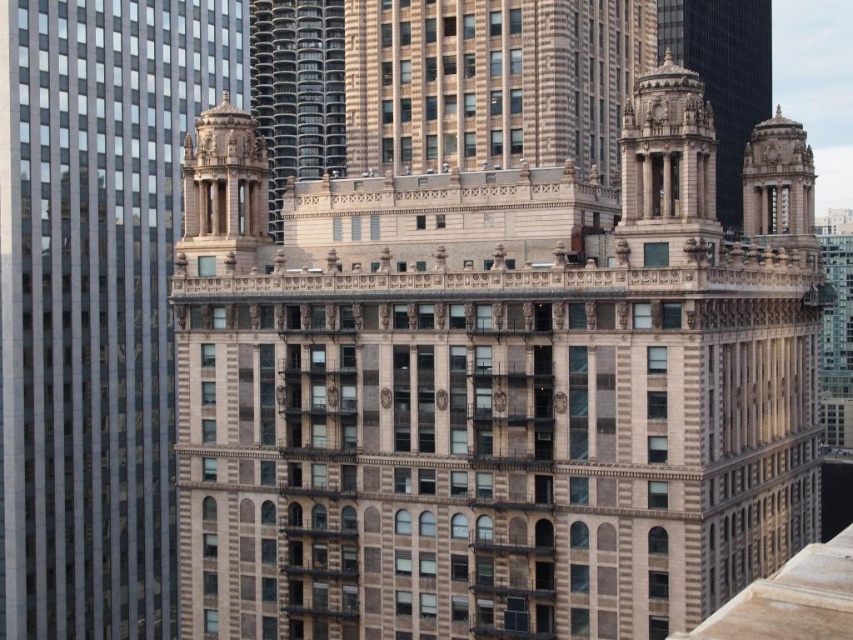
You are an architect examining the grand building. You notice the brown stone building at center and the beige stone tower at center. Which one is positioned lower in the image?

The brown stone building at center is positioned lower than the beige stone tower at center, as it is situated below it.

You are standing in front of a grand building and want to take a photo that captures its entire facade. The camera you are using has a standard lens with a field of view that can capture scenes up to 150 feet wide when the camera is positioned 150 feet away. Given that the brown stone building at center is 209.79 feet away from you, will you be able to capture the entire building in one shot without moving the camera?

The brown stone building at center is 209.79 feet from the camera, which is further than the 150 feet optimal distance. Since the camera lens can only capture up to 150 feet wide at 150 feet away, being farther away would reduce the apparent width captured. Therefore, you might not be able to capture the entire building in one shot without moving the camera.

You are standing at the point labeled point (x=495, y=388) in the image of the grand building. What is the object directly beneath you?

The point (x=495, y=388) corresponds to the brown stone building at center, so the object directly beneath you is the brown stone building at center.